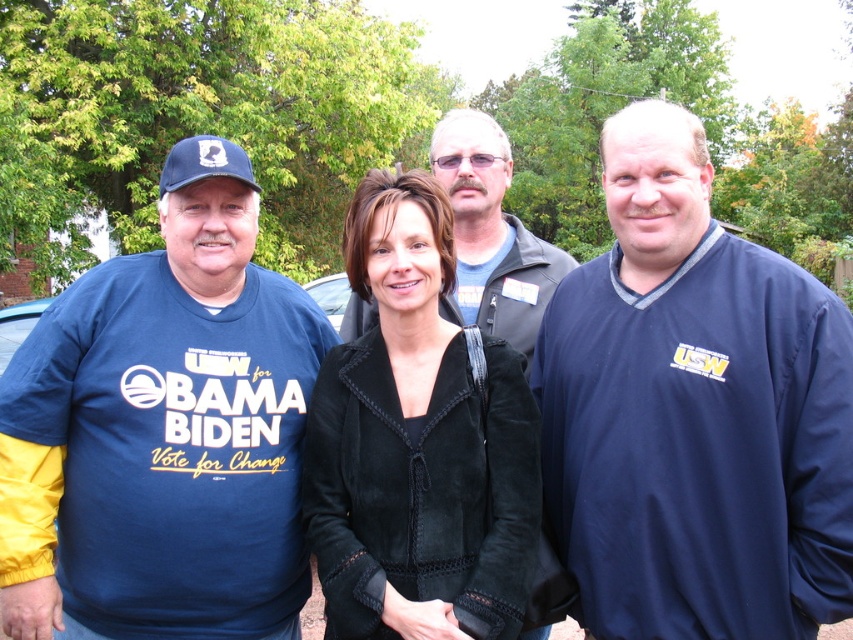
Who is shorter, navy blue sweater at right or blue fabric t-shirt at left?

Standing shorter between the two is blue fabric t-shirt at left.

From the picture: Between navy blue sweater at right and blue fabric t-shirt at left, which one appears on the left side from the viewer's perspective?

blue fabric t-shirt at left

Is point (631, 193) closer to camera compared to point (177, 592)?

Yes, it is in front of point (177, 592).

Find the location of a particular element. navy blue sweater at right is located at coordinates (693, 412).

Who is more distant from viewer, (675, 380) or (564, 273)?

The point (564, 273) is more distant.

Is point (805, 477) closer to camera compared to point (520, 280)?

Yes, it is.

I want to click on navy blue sweater at right, so click(693, 412).

Does navy blue sweater at right come behind velvet black jacket at center?

That is False.

Is point (728, 268) more distant than point (506, 600)?

Yes.

The height and width of the screenshot is (640, 853). I want to click on navy blue sweater at right, so click(x=693, y=412).